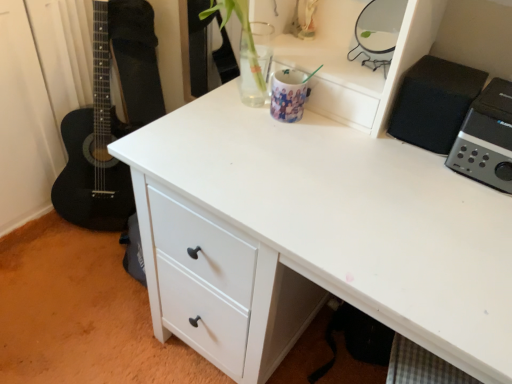
Question: Does metallic silver mirror at upper right, acting as the 2th appliance starting from the left, turn towards silver metallic speaker at upper right, which ranks as the 1th appliance in right-to-left order?

Choices:
 (A) yes
 (B) no

Answer: (B)

Question: Considering the relative sizes of metallic silver mirror at upper right, acting as the 2th appliance starting from the left, and silver metallic speaker at upper right, which ranks as the 1th appliance in right-to-left order, in the image provided, is metallic silver mirror at upper right, acting as the 2th appliance starting from the left, bigger than silver metallic speaker at upper right, which ranks as the 1th appliance in right-to-left order,?

Choices:
 (A) no
 (B) yes

Answer: (A)

Question: Considering the relative positions of metallic silver mirror at upper right, acting as the 3th appliance starting from the right, and silver metallic speaker at upper right, which ranks as the 1th appliance in right-to-left order, in the image provided, is metallic silver mirror at upper right, acting as the 3th appliance starting from the right, to the right of silver metallic speaker at upper right, which ranks as the 1th appliance in right-to-left order, from the viewer's perspective?

Choices:
 (A) yes
 (B) no

Answer: (B)

Question: Can you confirm if metallic silver mirror at upper right, acting as the 3th appliance starting from the right, is taller than silver metallic speaker at upper right, the fourth appliance from the left?

Choices:
 (A) yes
 (B) no

Answer: (B)

Question: Is metallic silver mirror at upper right, acting as the 2th appliance starting from the left, at the left side of silver metallic speaker at upper right, the fourth appliance from the left?

Choices:
 (A) no
 (B) yes

Answer: (B)

Question: Looking at the image, does glossy ceramic mug at upper center, marked as the first appliance in a left-to-right arrangement, seem bigger or smaller compared to metallic silver mirror at upper right, acting as the 2th appliance starting from the left?

Choices:
 (A) small
 (B) big

Answer: (A)

Question: In the image, is glossy ceramic mug at upper center, marked as the first appliance in a left-to-right arrangement, positioned in front of or behind metallic silver mirror at upper right, acting as the 3th appliance starting from the right?

Choices:
 (A) behind
 (B) front

Answer: (A)

Question: Which is correct: glossy ceramic mug at upper center, marked as the first appliance in a left-to-right arrangement, is inside metallic silver mirror at upper right, acting as the 3th appliance starting from the right, or outside of it?

Choices:
 (A) inside
 (B) outside

Answer: (B)

Question: From their relative heights in the image, would you say glossy ceramic mug at upper center, marked as the first appliance in a left-to-right arrangement, is taller or shorter than metallic silver mirror at upper right, acting as the 3th appliance starting from the right?

Choices:
 (A) tall
 (B) short

Answer: (B)

Question: Relative to silver metallic speaker at upper right, which ranks as the 1th appliance in right-to-left order, is metallic silver mirror at upper right, acting as the 3th appliance starting from the right, in front or behind?

Choices:
 (A) front
 (B) behind

Answer: (B)

Question: Is metallic silver mirror at upper right, acting as the 2th appliance starting from the left, inside the boundaries of silver metallic speaker at upper right, the fourth appliance from the left, or outside?

Choices:
 (A) inside
 (B) outside

Answer: (B)

Question: Considering the positions of metallic silver mirror at upper right, acting as the 3th appliance starting from the right, and silver metallic speaker at upper right, which ranks as the 1th appliance in right-to-left order, in the image, is metallic silver mirror at upper right, acting as the 3th appliance starting from the right, taller or shorter than silver metallic speaker at upper right, which ranks as the 1th appliance in right-to-left order,?

Choices:
 (A) short
 (B) tall

Answer: (A)

Question: From a real-world perspective, is metallic silver mirror at upper right, acting as the 2th appliance starting from the left, physically located above or below silver metallic speaker at upper right, which ranks as the 1th appliance in right-to-left order?

Choices:
 (A) above
 (B) below

Answer: (A)

Question: Is black matte speaker at upper right, the second appliance from the right, wider or thinner than silver metallic speaker at upper right, the fourth appliance from the left?

Choices:
 (A) wide
 (B) thin

Answer: (B)

Question: Considering the positions of black matte speaker at upper right, which ranks as the third appliance in left-to-right order, and silver metallic speaker at upper right, which ranks as the 1th appliance in right-to-left order, in the image, is black matte speaker at upper right, which ranks as the third appliance in left-to-right order, bigger or smaller than silver metallic speaker at upper right, which ranks as the 1th appliance in right-to-left order,?

Choices:
 (A) small
 (B) big

Answer: (A)